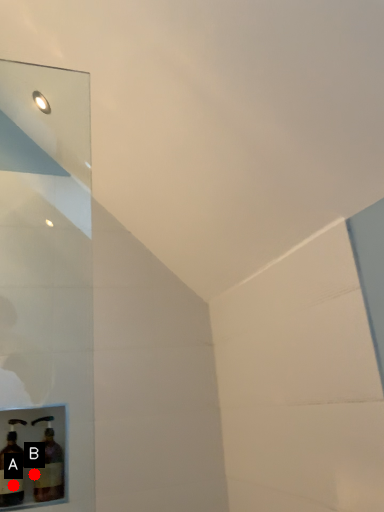
Question: Two points are circled on the image, labeled by A and B beside each circle. Which of the following is the farthest from the observer?

Choices:
 (A) A is further
 (B) B is further

Answer: (B)